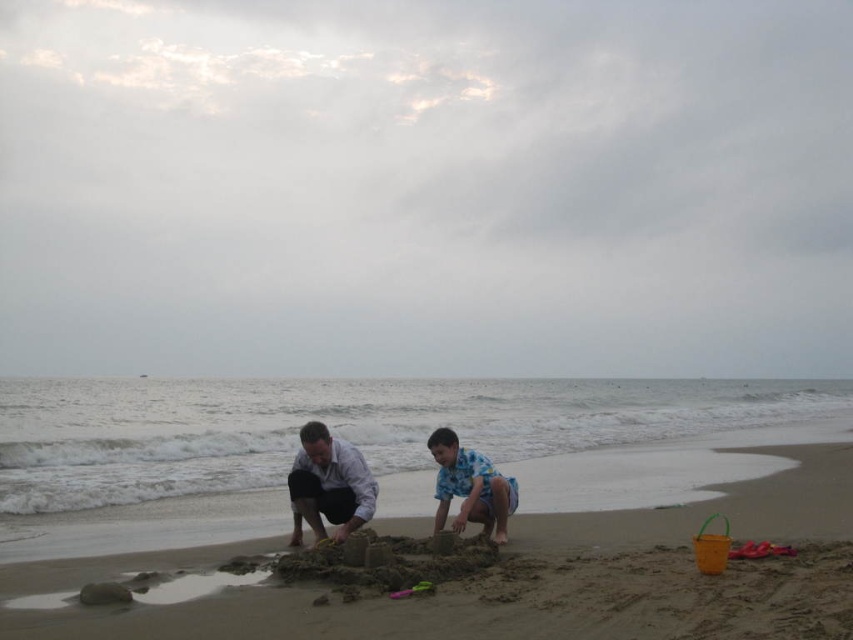
You are standing on the beach and see the sandcastle represented by the point at (491, 573). If you walk straight towards the ocean, will you reach the sandcastle before the water?

The sandcastle at center is represented by point (491, 573). Walking straight towards the ocean, you would reach the sandcastle before the water because it is located between you and the shoreline.